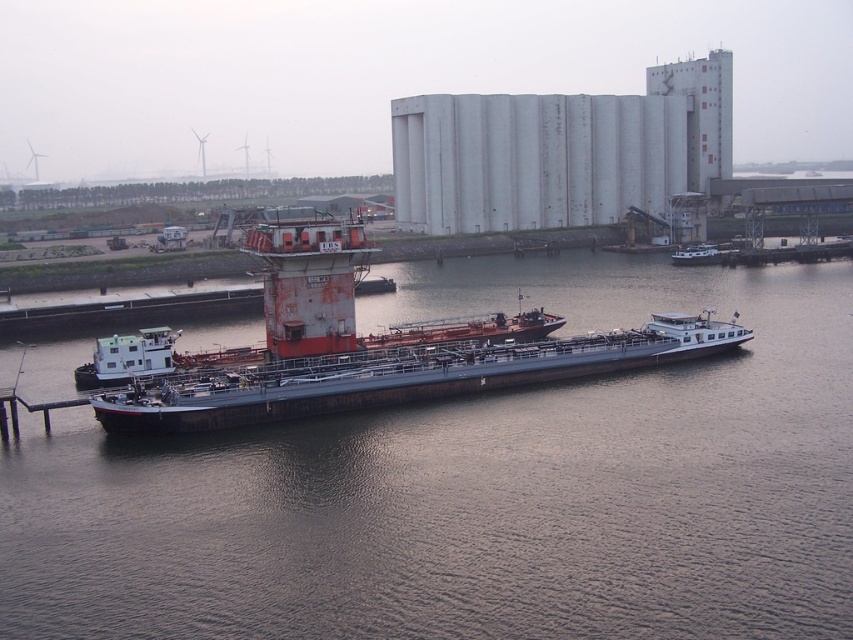
Question: Among these objects, which one is farthest from the camera?

Choices:
 (A) white matte barge at center-right
 (B) brown wooden river at center

Answer: (A)

Question: Is brown wooden river at center thinner than rusty metal barge at center?

Choices:
 (A) no
 (B) yes

Answer: (A)

Question: Is rusty metal barge at center to the right of white matte barge at center-right from the viewer's perspective?

Choices:
 (A) no
 (B) yes

Answer: (A)

Question: Which object is positioned closest to the brown wooden river at center?

Choices:
 (A) rusty metal barge at center
 (B) white matte barge at center-right
 (C) white plastic houseboat at center-left

Answer: (A)

Question: Which point appears closest to the camera in this image?

Choices:
 (A) (706, 244)
 (B) (556, 364)
 (C) (314, 540)

Answer: (C)

Question: Where is brown wooden river at center located in relation to white matte barge at center-right in the image?

Choices:
 (A) above
 (B) below

Answer: (B)